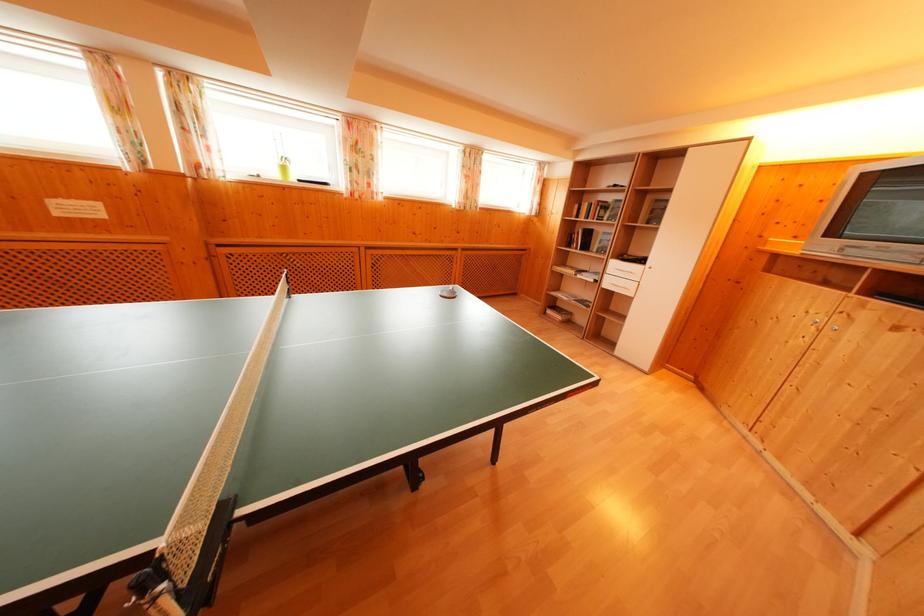
Which object does [284,168] point to?

It corresponds to the green plant pot in the image.